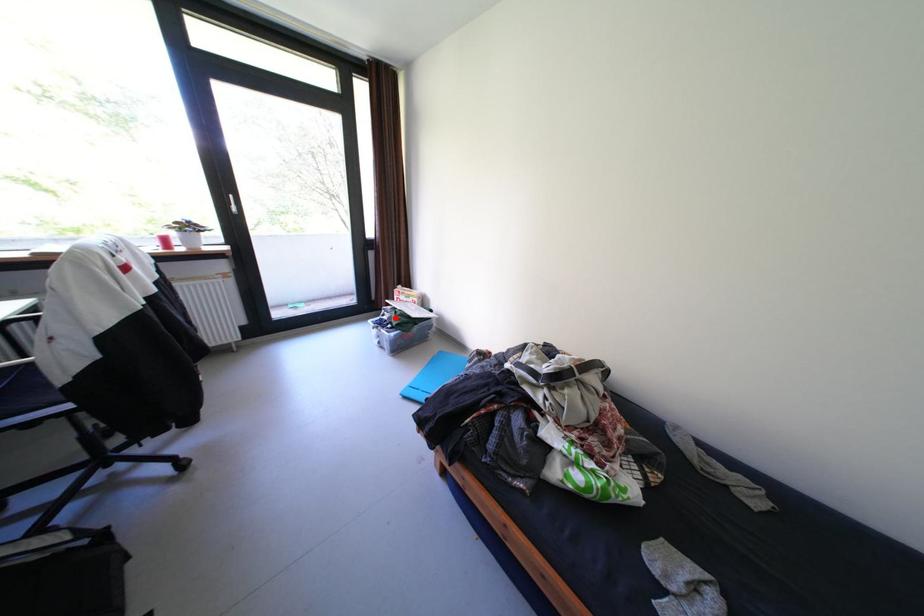
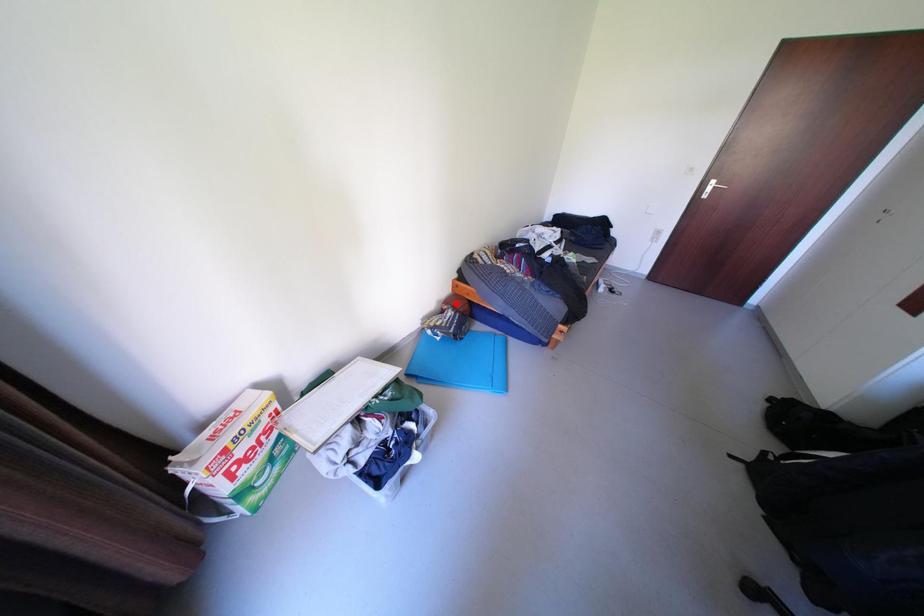
I am providing you with two images of the same scene from different viewpoints. A red point is marked on the first image and another point is marked on the second image. Are the points marked in image1 and image2 representing the same 3D position?

No